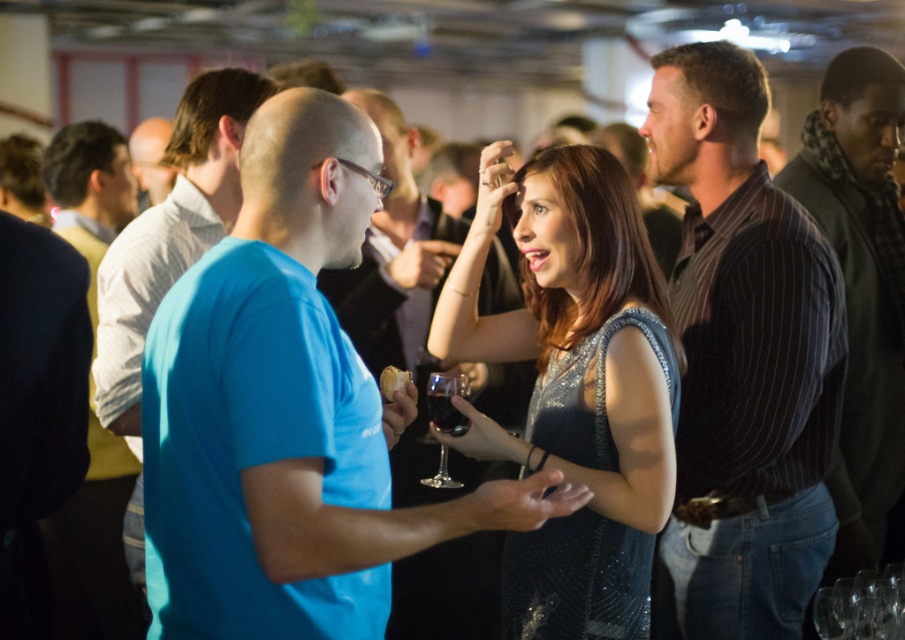
Is point (830, 579) closer to camera compared to point (396, 458)?

Yes, it is in front of point (396, 458).

At what (x,y) coordinates should I click in order to perform the action: click on dark gray pinstripe shirt at right. Please return your answer as a coordinate pair (x, y). This screenshot has width=905, height=640. Looking at the image, I should click on (861, 284).

Identify the location of blue shirt at left. The height and width of the screenshot is (640, 905). (94, 545).

Which is behind, point (662, 70) or point (439, 456)?

Point (439, 456)

Which is above, striped cotton shirt at right or transparent glass at center?

striped cotton shirt at right is above.

Who is more forward, (715, 349) or (437, 472)?

Point (715, 349) is more forward.

At what (x,y) coordinates should I click in order to perform the action: click on striped cotton shirt at right. Please return your answer as a coordinate pair (x, y). Looking at the image, I should click on (744, 356).